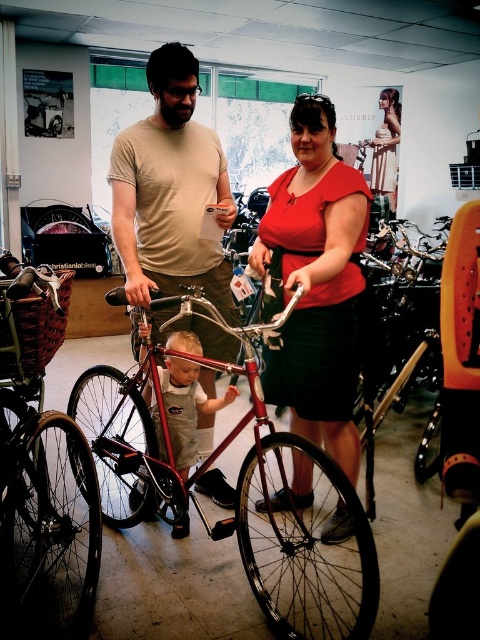
Which is more to the left, matte black bicycle at center or matte red dress at center?

matte black bicycle at center is more to the left.

How much distance is there between matte black bicycle at center and matte red dress at center?

A distance of 5.55 meters exists between matte black bicycle at center and matte red dress at center.

Does point (11, 609) lie behind point (388, 152)?

No, it is in front of (388, 152).

The image size is (480, 640). In order to click on matte black bicycle at center in this screenshot , I will do `click(43, 480)`.

Can you confirm if matte black bicycle at center is positioned to the right of light brown denim overalls at center?

In fact, matte black bicycle at center is to the left of light brown denim overalls at center.

This screenshot has width=480, height=640. I want to click on matte black bicycle at center, so click(x=43, y=480).

Is point (0, 400) behind point (186, 371)?

That is False.

Find the location of a particular element. This screenshot has width=480, height=640. matte black bicycle at center is located at coordinates (43, 480).

Can you confirm if shiny metallic bicycle at center is positioned above matte beige t-shirt at center?

No, shiny metallic bicycle at center is not above matte beige t-shirt at center.

Can you confirm if shiny metallic bicycle at center is positioned to the left of matte beige t-shirt at center?

Yes, shiny metallic bicycle at center is to the left of matte beige t-shirt at center.

What are the coordinates of `shiny metallic bicycle at center` in the screenshot? It's located at (237, 504).

Where is `shiny metallic bicycle at center`? The width and height of the screenshot is (480, 640). shiny metallic bicycle at center is located at coordinates (237, 504).